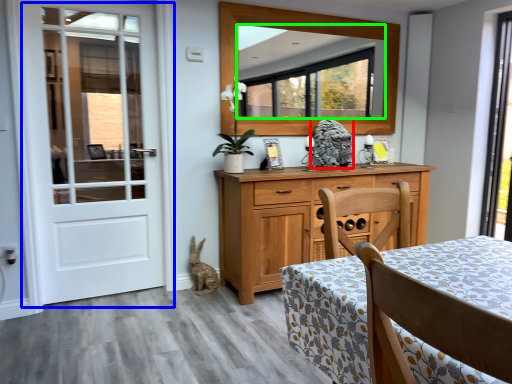
Question: Which is nearer to the animal (highlighted by a red box)? door (highlighted by a blue box) or mirror (highlighted by a green box).

Choices:
 (A) door
 (B) mirror

Answer: (B)